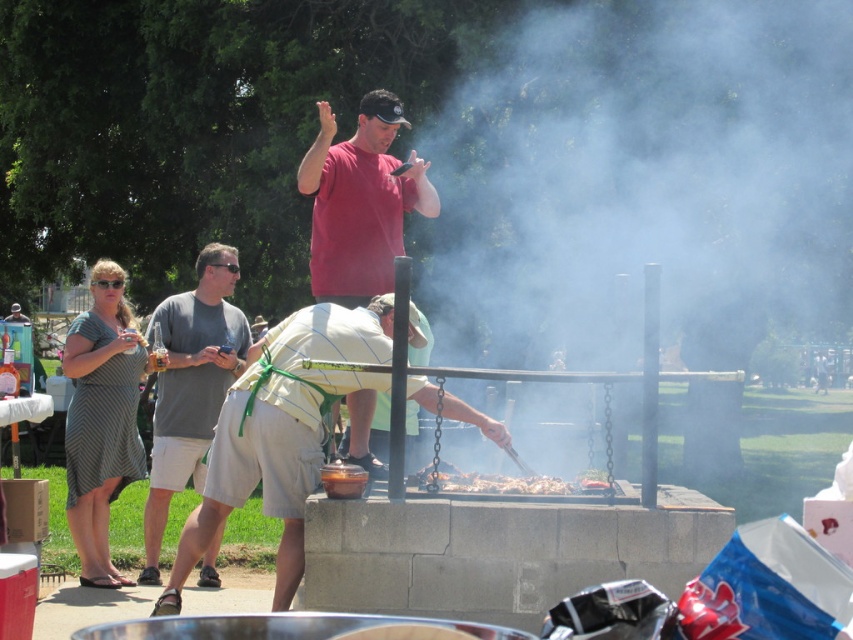
In the barbecue scene, there is a man in a yellow shirt and green apron tending the grill and a gray cotton t shirt at left represented by point (190, 387). Which of these two people is closer to the grill?

The gray cotton t shirt at left represented by point (190, 387) is closer to the grill than the man in the yellow shirt and green apron.